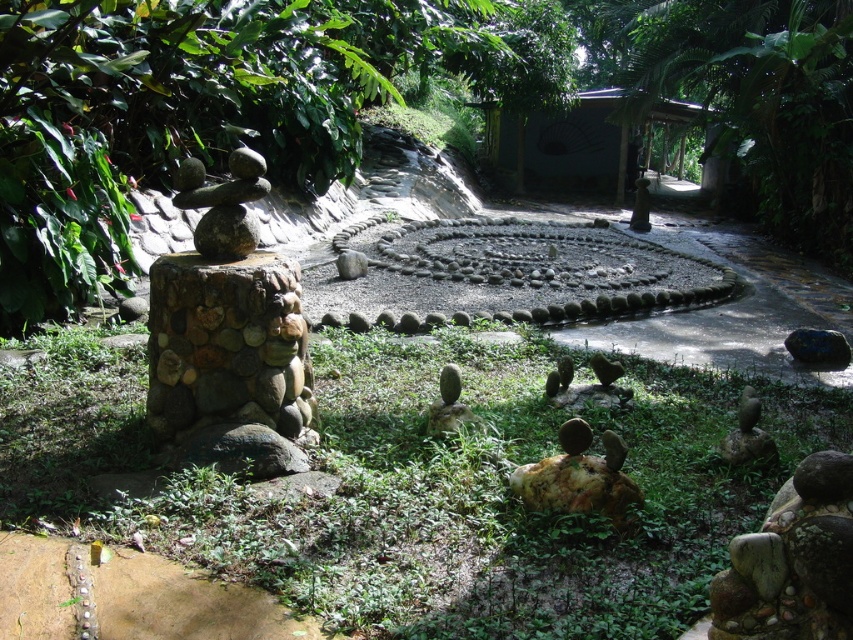
You are standing at the center of the labyrinth and want to locate the rustic stone sculpture at left. Based on the coordinates provided, in which direction should you look to see it?

The rustic stone sculpture at left is located at coordinates point [228,336], which is to the left side of the scene. Since you are at the center of the labyrinth, you should look to your left to see the rustic stone sculpture at left.